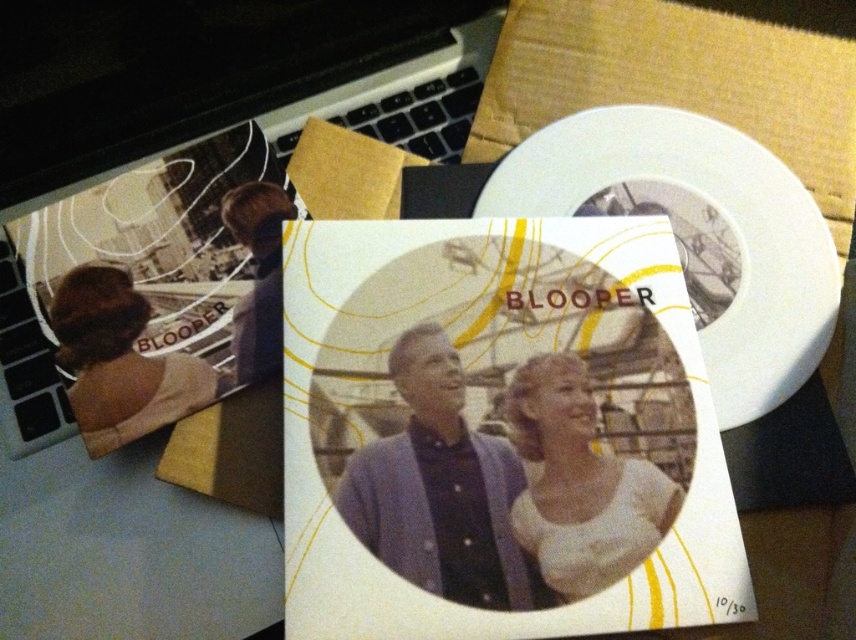
Is matte white postcard at center further to the viewer compared to silver metallic laptop at upper center?

No, matte white postcard at center is in front of silver metallic laptop at upper center.

Is matte white postcard at center positioned in front of silver metallic laptop at upper center?

Yes, it is in front of silver metallic laptop at upper center.

Does point (617, 621) lie behind point (443, 56)?

No, (617, 621) is in front of (443, 56).

Find the location of `matte white postcard at center`. matte white postcard at center is located at coordinates (498, 433).

Which is above, silver metallic laptop at upper center or purple fabric at center?

silver metallic laptop at upper center is higher up.

Does point (18, 442) come closer to viewer compared to point (432, 500)?

That is False.

From the picture: Who is more distant from viewer, (x=45, y=372) or (x=391, y=541)?

The point (x=45, y=372) is more distant.

Where is `silver metallic laptop at upper center`? The width and height of the screenshot is (856, 640). silver metallic laptop at upper center is located at coordinates (205, 164).

Looking at this image, which is below, matte white postcard at center or purple fabric at center?

purple fabric at center is below.

Does point (337, 458) come behind point (431, 412)?

No, it is not.

Find the location of `matte white postcard at center`. matte white postcard at center is located at coordinates (498, 433).